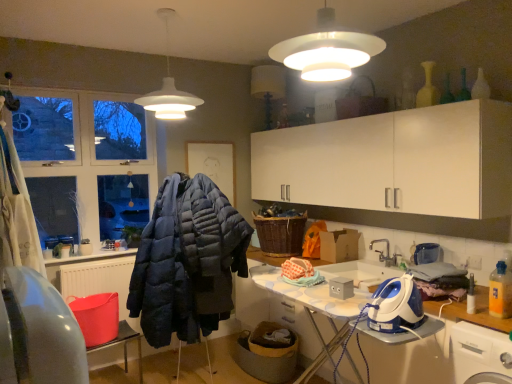
Locate an element on the screen. woven brown basket at center is located at coordinates (280, 234).

Between blue plastic iron at lower right and white matte lampshade at upper center, which appears as the second lamp when viewed from the back, which one has larger size?

white matte lampshade at upper center, which appears as the second lamp when viewed from the back, is bigger.

Considering the relative sizes of blue plastic iron at lower right and white matte lampshade at upper center, which appears as the second lamp when viewed from the back, in the image provided, is blue plastic iron at lower right shorter than white matte lampshade at upper center, which appears as the second lamp when viewed from the back,?

Yes.

Would you consider blue plastic iron at lower right to be distant from white matte lampshade at upper center, the second lamp viewed from the left?

Indeed, blue plastic iron at lower right is not near white matte lampshade at upper center, the second lamp viewed from the left.

How much distance is there between blue plastic iron at lower right and white matte lampshade at upper center, the first lamp positioned from the front?

blue plastic iron at lower right and white matte lampshade at upper center, the first lamp positioned from the front, are 1.20 meters apart.

From a real-world perspective, which object rests below the other?

From a 3D spatial view, blue plastic iron at lower right is below.

Between white matte lampshade at upper center, the second lamp viewed from the left, and blue plastic iron at lower right, which one has smaller size?

blue plastic iron at lower right is smaller.

Is white matte lampshade at upper center, which is counted as the 1th lamp, starting from the right, facing away from blue plastic iron at lower right?

white matte lampshade at upper center, which is counted as the 1th lamp, starting from the right, does not have its back to blue plastic iron at lower right.

How many degrees apart are the facing directions of white matte lampshade at upper center, which appears as the second lamp when viewed from the back, and blue plastic iron at lower right?

They differ by 93.9 degrees in their facing directions.

Is white matte lampshade at upper center, the 1th lamp when ordered from left to right, at the right side of white plastic washing machine at lower right?

In fact, white matte lampshade at upper center, the 1th lamp when ordered from left to right, is to the left of white plastic washing machine at lower right.

From a real-world perspective, who is located higher, white matte lampshade at upper center, the second lamp from the right, or white plastic washing machine at lower right?

In real-world perspective, white matte lampshade at upper center, the second lamp from the right, is above.

Considering the sizes of objects white matte lampshade at upper center, the second lamp from the right, and white plastic washing machine at lower right in the image provided, who is thinner, white matte lampshade at upper center, the second lamp from the right, or white plastic washing machine at lower right?

Thinner between the two is white matte lampshade at upper center, the second lamp from the right.

Is silver metallic faucet at sink right to the left of dark blue quilted jacket at center from the viewer's perspective?

In fact, silver metallic faucet at sink right is to the right of dark blue quilted jacket at center.

Can you tell me how much silver metallic faucet at sink right and dark blue quilted jacket at center differ in facing direction?

The angular difference between silver metallic faucet at sink right and dark blue quilted jacket at center is 90.6 degrees.

From a real-world perspective, which object stands above the other?

silver metallic faucet at sink right, from a real-world perspective.

Is silver metallic faucet at sink right in front of or behind dark blue quilted jacket at center in the image?

Clearly, silver metallic faucet at sink right is behind dark blue quilted jacket at center.

Is white plastic washing machine at lower right in front of or behind blue plastic iron at lower right in the image?

In the image, white plastic washing machine at lower right appears in front of blue plastic iron at lower right.

In terms of height, does white plastic washing machine at lower right look taller or shorter compared to blue plastic iron at lower right?

In the image, white plastic washing machine at lower right appears to be taller than blue plastic iron at lower right.

Is white plastic washing machine at lower right bigger or smaller than blue plastic iron at lower right?

white plastic washing machine at lower right is bigger than blue plastic iron at lower right.

Is white plastic washing machine at lower right completely or partially outside of blue plastic iron at lower right?

Yes, white plastic washing machine at lower right is located beyond the bounds of blue plastic iron at lower right.

Considering the positions of objects white matte lampshade at upper center, arranged as the 1th lamp when viewed from the back, and woven brown basket at center in the image provided, who is more to the left, white matte lampshade at upper center, arranged as the 1th lamp when viewed from the back, or woven brown basket at center?

white matte lampshade at upper center, arranged as the 1th lamp when viewed from the back.

From the image's perspective, is white matte lampshade at upper center, the 2th lamp from the front, over woven brown basket at center?

Yes, from the image's perspective, white matte lampshade at upper center, the 2th lamp from the front, is above woven brown basket at center.

Considering the sizes of objects white matte lampshade at upper center, the second lamp from the right, and woven brown basket at center in the image provided, who is wider, white matte lampshade at upper center, the second lamp from the right, or woven brown basket at center?

woven brown basket at center is wider.

Identify the location of basket behind the white matte lampshade at upper center, arranged as the 1th lamp when viewed from the back. This screenshot has height=384, width=512. (280, 234).

Is dark blue quilted jacket at center at the left side of blue plastic iron at lower right?

Correct, you'll find dark blue quilted jacket at center to the left of blue plastic iron at lower right.

Can you confirm if dark blue quilted jacket at center is thinner than blue plastic iron at lower right?

No, dark blue quilted jacket at center is not thinner than blue plastic iron at lower right.

Does dark blue quilted jacket at center turn towards blue plastic iron at lower right?

Yes, dark blue quilted jacket at center is facing blue plastic iron at lower right.

Is dark blue quilted jacket at center positioned far away from blue plastic iron at lower right?

Yes, dark blue quilted jacket at center and blue plastic iron at lower right are quite far apart.

At what (x,y) coordinates should I click in order to perform the action: click on the 1st lamp positioned above the blue plastic iron at lower right (from a real-world perspective). Please return your answer as a coordinate pair (x, y). The width and height of the screenshot is (512, 384). Looking at the image, I should click on (327, 50).

You are a GUI agent. You are given a task and a screenshot of the screen. Output one action in this format:
    pyautogui.click(x=<x>, y=<y>)
    Task: Click on the lamp that is the 1st object located above the blue plastic iron at lower right (from the image's perspective)
    
    Given the screenshot: What is the action you would take?
    click(x=327, y=50)

Consider the image. When comparing their distances from white matte lampshade at upper center, the second lamp from the right, does dark blue quilted jacket at center or woven brown basket at center seem further?

woven brown basket at center.

Based on their spatial positions, is silver metallic faucet at sink right or white matte lampshade at upper center, which is counted as the 1th lamp, starting from the right, closer to dark blue quilted jacket at center?

silver metallic faucet at sink right is closer to dark blue quilted jacket at center.

Estimate the real-world distances between objects in this image. Which object is further from silver metallic faucet at sink right, woven brown basket at center or white matte lampshade at upper center, arranged as the 1th lamp when viewed from the back?

The object further to silver metallic faucet at sink right is white matte lampshade at upper center, arranged as the 1th lamp when viewed from the back.

When comparing their distances from white matte lampshade at upper center, the second lamp from the right, does silver metallic faucet at sink right or woven brown basket at center seem further?

silver metallic faucet at sink right.

Based on their spatial positions, is silver metallic faucet at sink right or blue plastic iron at lower right further from white matte lampshade at upper center, the 2th lamp from the front?

silver metallic faucet at sink right.

Considering their positions, is white glossy countertop at lower right positioned further to silver metallic faucet at sink right than woven brown basket at center?

white glossy countertop at lower right lies further to silver metallic faucet at sink right than the other object.

Estimate the real-world distances between objects in this image. Which object is closer to silver metallic faucet at sink right, white matte lampshade at upper center, the first lamp positioned from the front, or white glossy countertop at lower right?

The object closer to silver metallic faucet at sink right is white glossy countertop at lower right.

Estimate the real-world distances between objects in this image. Which object is further from blue plastic iron at lower right, white glossy countertop at lower right or white matte lampshade at upper center, which is counted as the 1th lamp, starting from the right?

white matte lampshade at upper center, which is counted as the 1th lamp, starting from the right.

This screenshot has width=512, height=384. Find the location of `washing machine between white matte lampshade at upper center, the first lamp positioned from the front, and white glossy countertop at lower right, in the vertical direction`. washing machine between white matte lampshade at upper center, the first lamp positioned from the front, and white glossy countertop at lower right, in the vertical direction is located at coordinates (479, 351).

This screenshot has width=512, height=384. What are the coordinates of `lamp that lies between white matte lampshade at upper center, the 2th lamp from the front, and blue plastic iron at lower right from top to bottom` in the screenshot? It's located at (327, 50).

Where is `appliance between white matte lampshade at upper center, which is counted as the 1th lamp, starting from the right, and white plastic washing machine at lower right from top to bottom`? appliance between white matte lampshade at upper center, which is counted as the 1th lamp, starting from the right, and white plastic washing machine at lower right from top to bottom is located at coordinates (395, 306).

You are a GUI agent. You are given a task and a screenshot of the screen. Output one action in this format:
    pyautogui.click(x=<x>, y=<y>)
    Task: Click on the appliance positioned between white plastic washing machine at lower right and silver metallic faucet at sink right from near to far
    
    Given the screenshot: What is the action you would take?
    pyautogui.click(x=395, y=306)